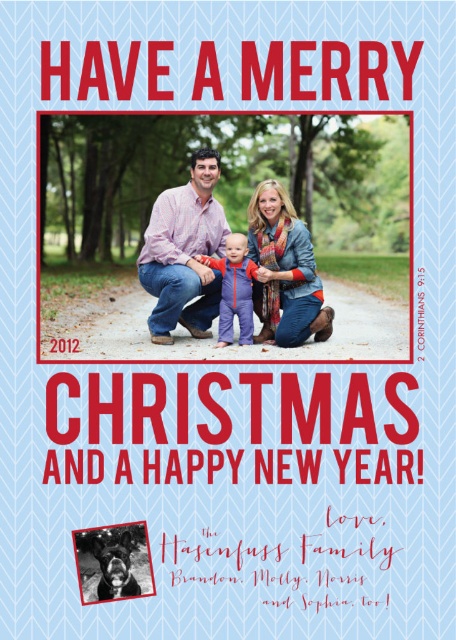
Question: Does denim jacket at center come in front of matte pink shirt at center?

Choices:
 (A) no
 (B) yes

Answer: (B)

Question: Can you confirm if denim jacket at center is thinner than matte pink shirt at center?

Choices:
 (A) no
 (B) yes

Answer: (A)

Question: Which object is the farthest from the matte pink shirt at center?

Choices:
 (A) purple fleece jumpsuit at center
 (B) denim jacket at center

Answer: (A)

Question: Can you confirm if denim jacket at center is positioned to the left of purple fleece jumpsuit at center?

Choices:
 (A) no
 (B) yes

Answer: (B)

Question: Among these objects, which one is farthest from the camera?

Choices:
 (A) denim jacket at center
 (B) matte pink shirt at center
 (C) purple fleece jumpsuit at center

Answer: (C)

Question: Which of the following is the closest to the observer?

Choices:
 (A) purple fleece jumpsuit at center
 (B) matte pink shirt at center

Answer: (B)